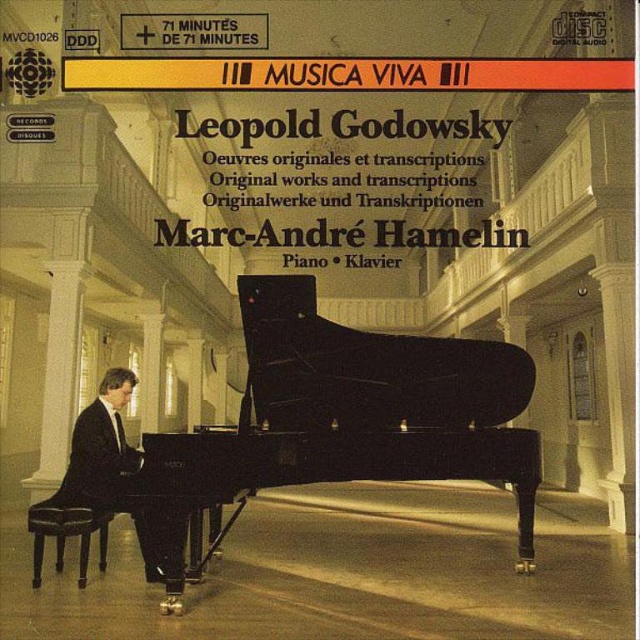
Is black polished piano at center wider than black suit at left?

Correct, the width of black polished piano at center exceeds that of black suit at left.

Find the location of `black polished piano at center`. black polished piano at center is located at coordinates (349, 416).

What do you see at coordinates (349, 416) in the screenshot? I see `black polished piano at center` at bounding box center [349, 416].

Find the location of a particular element. The height and width of the screenshot is (640, 640). black polished piano at center is located at coordinates (349, 416).